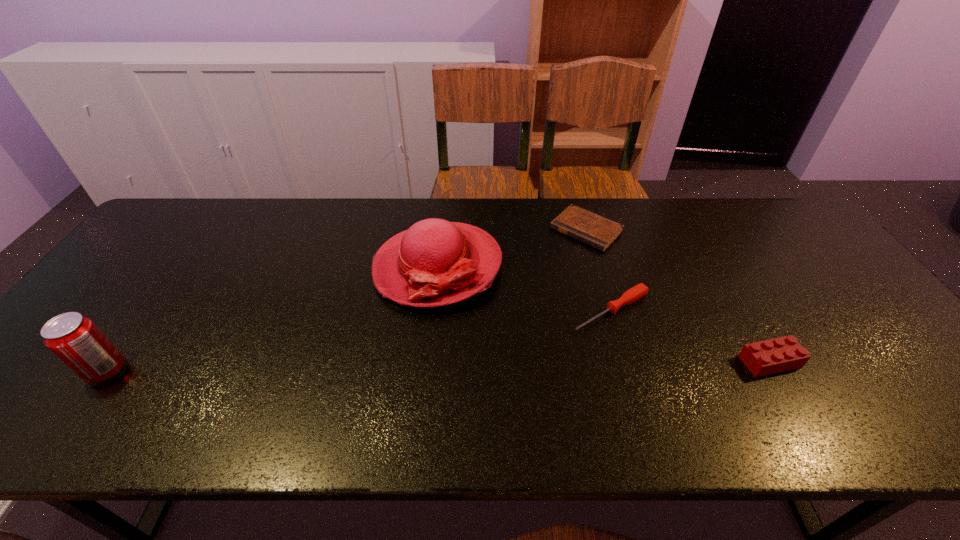
Where is `vacant position located on the spine side of the shortest object`? The height and width of the screenshot is (540, 960). vacant position located on the spine side of the shortest object is located at coordinates (544, 270).

The height and width of the screenshot is (540, 960). I want to click on free location located at the front of the hat with a bow, so click(358, 361).

In order to click on free space located 0.210m at the front of the hat with a bow in this screenshot , I will do `click(350, 370)`.

The height and width of the screenshot is (540, 960). What are the coordinates of `vacant area situated 0.100m at the front of the hat with a bow` in the screenshot? It's located at (378, 336).

Find the location of `free location located at the tip of the fourth tallest object`. free location located at the tip of the fourth tallest object is located at coordinates (518, 360).

Image resolution: width=960 pixels, height=540 pixels. In order to click on vacant space located 0.260m at the tip of the fourth tallest object in this screenshot , I will do `click(497, 373)`.

This screenshot has width=960, height=540. Find the location of `vacant space located at the tip of the fourth tallest object`. vacant space located at the tip of the fourth tallest object is located at coordinates (557, 338).

The image size is (960, 540). What are the coordinates of `diary present at the far edge` in the screenshot? It's located at (599, 232).

Locate an element on the screen. hat that is at the far edge is located at coordinates (435, 262).

Where is `soda that is positioned at the near edge`? The image size is (960, 540). soda that is positioned at the near edge is located at coordinates (75, 339).